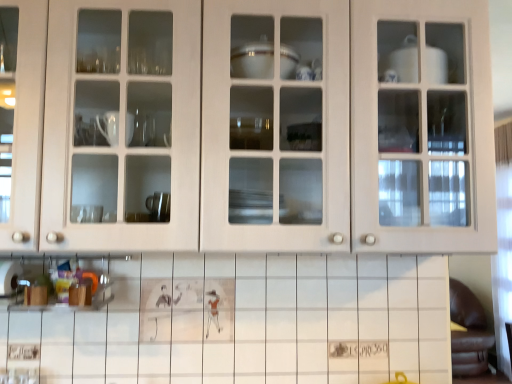
Question: Should I look upward or downward to see white matte cabinet at upper center?

Choices:
 (A) down
 (B) up

Answer: (B)